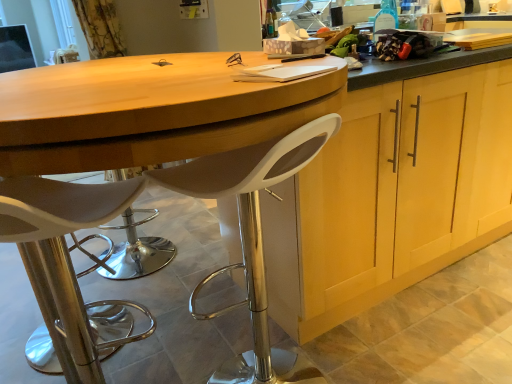
Question: From a real-world perspective, is white plastic stool at lower left, which ranks as the second chair in right-to-left order, positioned above or below white plastic stool at center, the 2th chair positioned from the left?

Choices:
 (A) above
 (B) below

Answer: (A)

Question: Is white plastic stool at lower left, the 1th chair when ordered from left to right, wider or thinner than white plastic stool at center, the first chair when ordered from right to left?

Choices:
 (A) wide
 (B) thin

Answer: (B)

Question: Considering the real-world distances, which object is farthest from the matte wood cabinet at center?

Choices:
 (A) white plastic stool at lower left, the 1th chair when ordered from left to right
 (B) white plastic stool at center, the 2th chair positioned from the left

Answer: (A)

Question: Considering the real-world distances, which object is closest to the white plastic stool at lower left, the 1th chair when ordered from left to right?

Choices:
 (A) matte wood cabinet at center
 (B) white plastic stool at center, the first chair when ordered from right to left

Answer: (B)